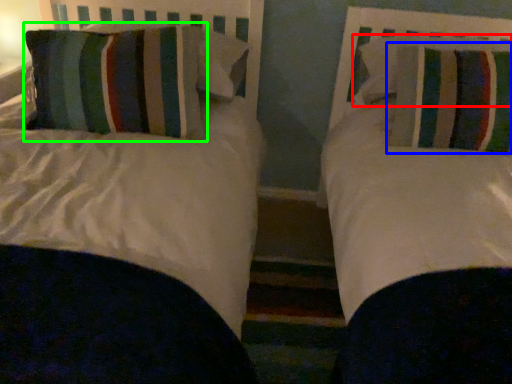
Question: Estimate the real-world distances between objects in this image. Which object is closer to pillow (highlighted by a red box), pillow (highlighted by a blue box) or pillow (highlighted by a green box)?

Choices:
 (A) pillow
 (B) pillow

Answer: (A)